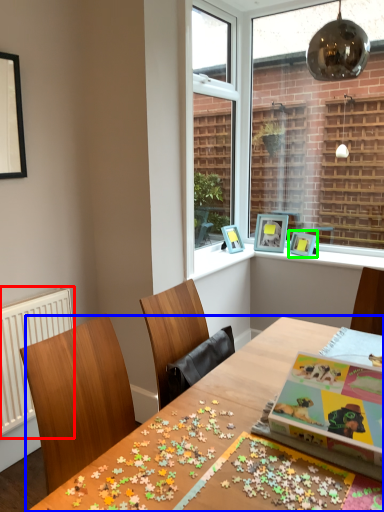
Question: Which object is the farthest from radiator (highlighted by a red box)? Choose among these: table (highlighted by a blue box) or picture frame (highlighted by a green box).

Choices:
 (A) table
 (B) picture frame

Answer: (B)